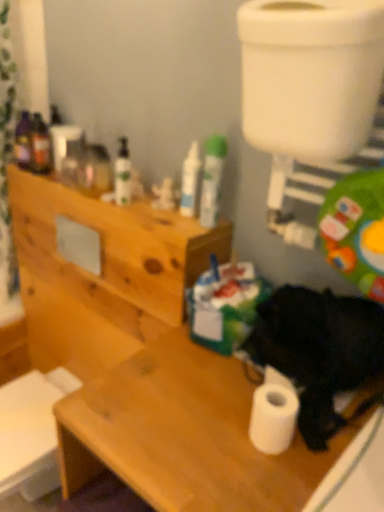
The height and width of the screenshot is (512, 384). Find the location of `vacant space that is to the left of white matte tube at center, the 3th toiletry from the left`. vacant space that is to the left of white matte tube at center, the 3th toiletry from the left is located at coordinates (163, 215).